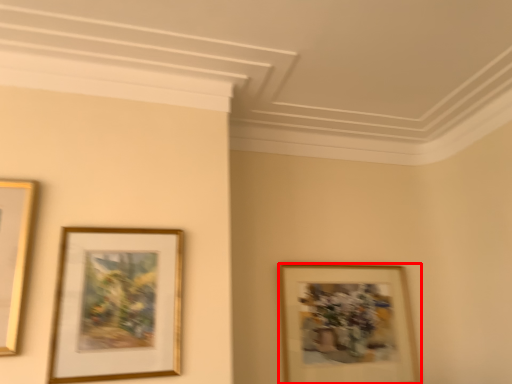
Question: From the image's perspective, what is the correct spatial relationship of picture frame (annotated by the red box) in relation to picture frame?

Choices:
 (A) below
 (B) above

Answer: (A)